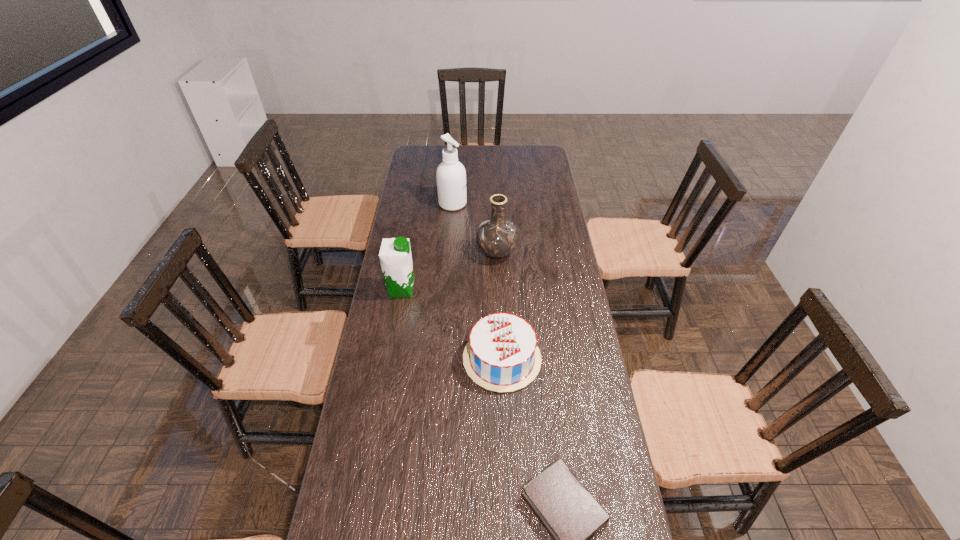
This screenshot has height=540, width=960. Find the location of `free region located 0.130m on the front of the birthday cake`. free region located 0.130m on the front of the birthday cake is located at coordinates (505, 435).

I want to click on object at the left edge, so click(395, 256).

Find the location of `vacant space at the far edge of the desktop`. vacant space at the far edge of the desktop is located at coordinates (498, 151).

At what (x,y) coordinates should I click in order to perform the action: click on free space at the left edge of the desktop. Please return your answer as a coordinate pair (x, y). Image resolution: width=960 pixels, height=540 pixels. Looking at the image, I should click on (414, 374).

Find the location of `vacant space at the right edge of the desktop`. vacant space at the right edge of the desktop is located at coordinates (549, 279).

Find the location of `vacant space at the far left corner`. vacant space at the far left corner is located at coordinates (422, 159).

This screenshot has width=960, height=540. Find the location of `vacant region between the fourth farthest object and the third farthest object`. vacant region between the fourth farthest object and the third farthest object is located at coordinates (452, 324).

Identify the location of free space between the fourth nearest object and the fourth object from right to left. (474, 228).

Find the location of a particular element. The image size is (960, 540). vacant space that's between the farthest object and the vase is located at coordinates (474, 228).

You are a GUI agent. You are given a task and a screenshot of the screen. Output one action in this format:
    pyautogui.click(x=<x>, y=<y>)
    Task: Click on the free space that is in between the fourth farthest object and the tallest object
    The width and height of the screenshot is (960, 540).
    Given the screenshot: What is the action you would take?
    pyautogui.click(x=477, y=281)